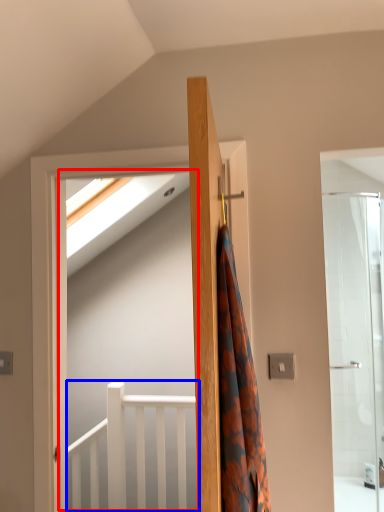
Question: Which point is closer to the camera, screen door (highlighted by a red box) or balustrade (highlighted by a blue box)?

Choices:
 (A) screen door
 (B) balustrade

Answer: (A)